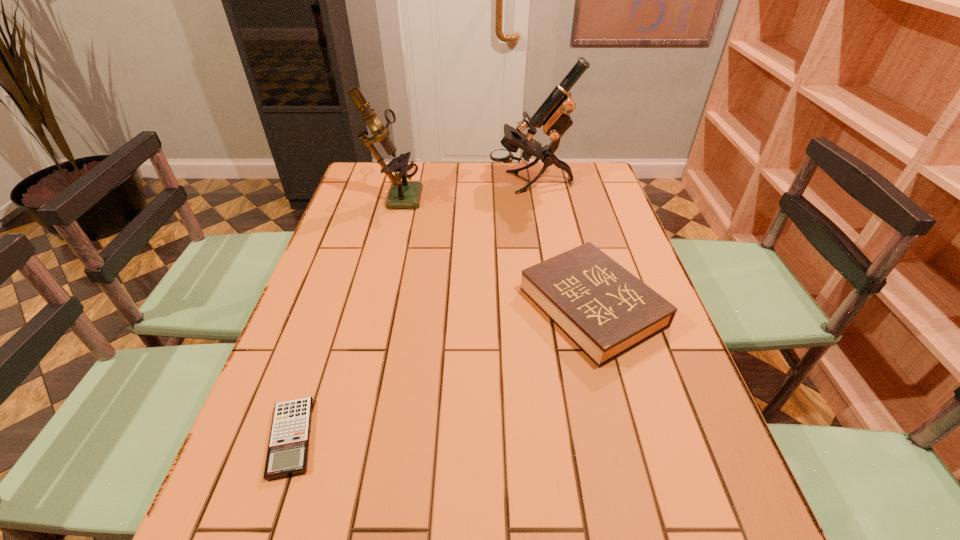
Where is `free space located 0.090m on the back of the hardback book`? This screenshot has height=540, width=960. free space located 0.090m on the back of the hardback book is located at coordinates (574, 240).

Where is `vacant space located on the back of the calculator`? The height and width of the screenshot is (540, 960). vacant space located on the back of the calculator is located at coordinates (344, 282).

You are a GUI agent. You are given a task and a screenshot of the screen. Output one action in this format:
    pyautogui.click(x=<x>, y=<y>)
    Task: Click on the microscope at the left edge
    The width and height of the screenshot is (960, 540).
    Given the screenshot: What is the action you would take?
    pyautogui.click(x=403, y=194)

What are the coordinates of `calculator at the left edge` in the screenshot? It's located at (288, 448).

You are a GUI agent. You are given a task and a screenshot of the screen. Output one action in this format:
    pyautogui.click(x=<x>, y=<y>)
    Task: Click on the microscope at the right edge
    The height and width of the screenshot is (540, 960).
    Given the screenshot: What is the action you would take?
    pyautogui.click(x=553, y=115)

Find the location of a particular element. hardback book that is at the right edge is located at coordinates (605, 310).

Identify the location of object present at the far left corner. Image resolution: width=960 pixels, height=540 pixels. (403, 194).

The image size is (960, 540). What are the coordinates of `object that is at the far right corner` in the screenshot? It's located at (553, 115).

In the image, there is a desktop. Where is `free space at the far edge`? free space at the far edge is located at coordinates (561, 181).

The image size is (960, 540). I want to click on free space at the left edge, so click(x=322, y=268).